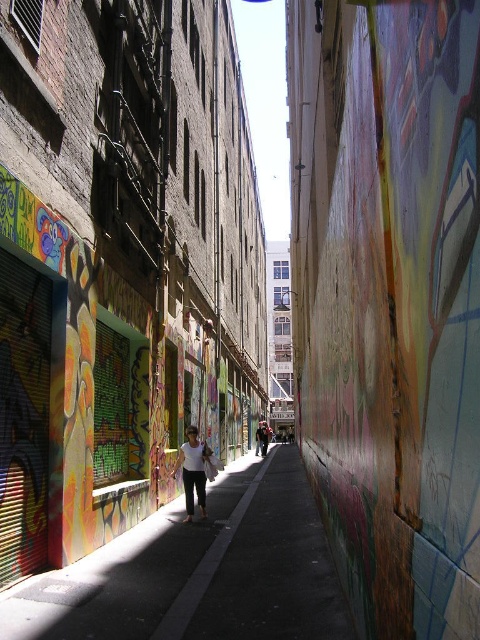
Is point (238, 516) positioned in front of point (187, 500)?

No, it is behind (187, 500).

You are a GUI agent. You are given a task and a screenshot of the screen. Output one action in this format:
    pyautogui.click(x=<x>, y=<y>)
    Task: Click on the dark asphalt pavement at center
    This screenshot has width=480, height=640.
    Given the screenshot: What is the action you would take?
    pyautogui.click(x=200, y=570)